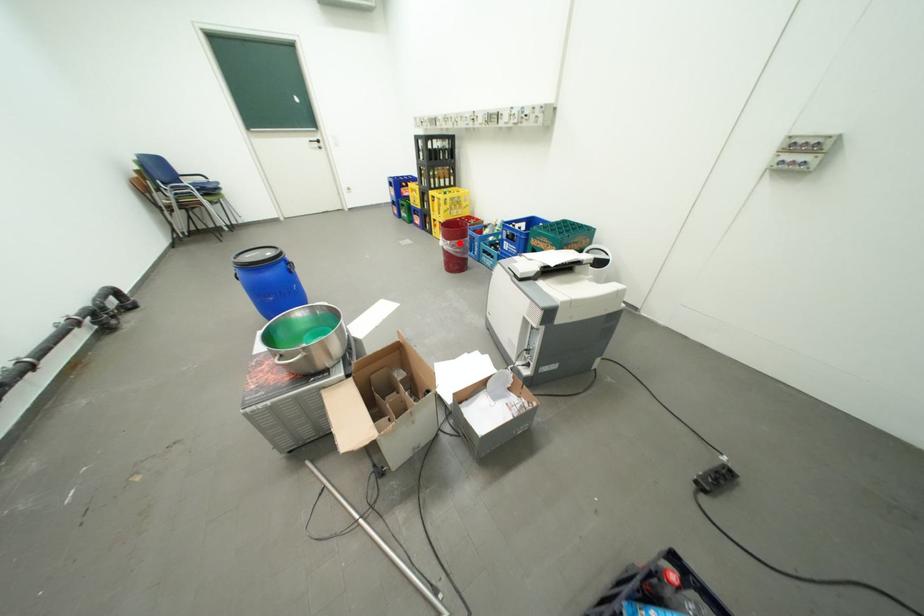
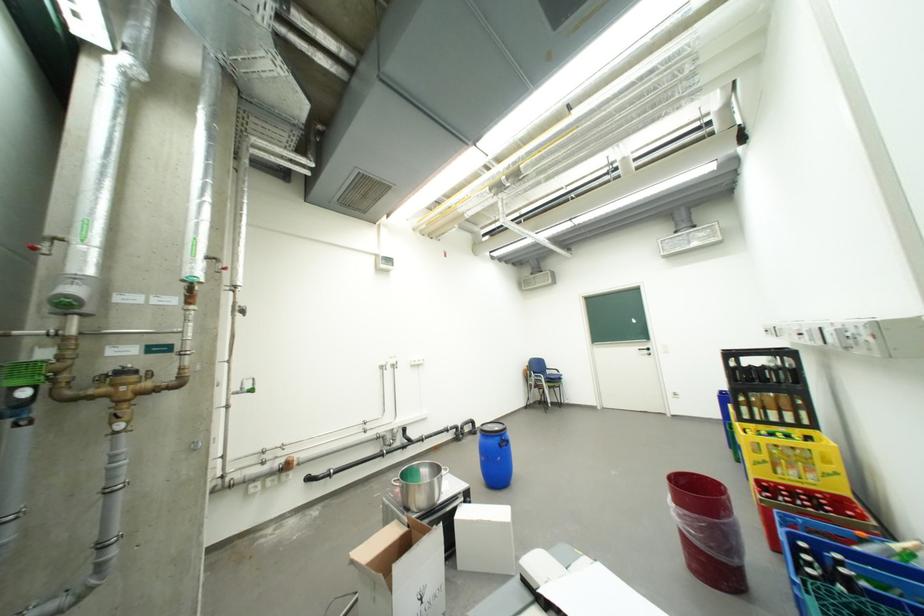
Question: I am providing you with two images of the same scene from different viewpoints. In image1, a red point is highlighted. Considering the same 3D point in image2, which of the following is correct?

Choices:
 (A) It is closer
 (B) It is farther

Answer: (B)